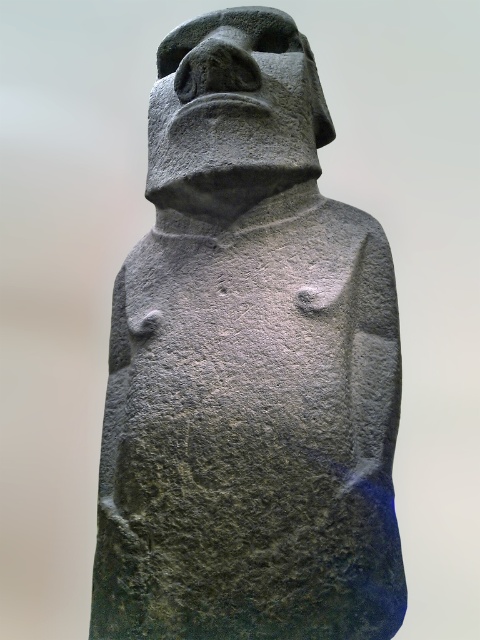
Is the position of gray stone statue at center more distant than that of gray stone head at upper center?

No, gray stone statue at center is in front of gray stone head at upper center.

Which of these two, gray stone statue at center or gray stone head at upper center, stands taller?

With more height is gray stone statue at center.

Image resolution: width=480 pixels, height=640 pixels. What do you see at coordinates (248, 365) in the screenshot?
I see `gray stone statue at center` at bounding box center [248, 365].

Image resolution: width=480 pixels, height=640 pixels. In order to click on gray stone statue at center in this screenshot , I will do `click(248, 365)`.